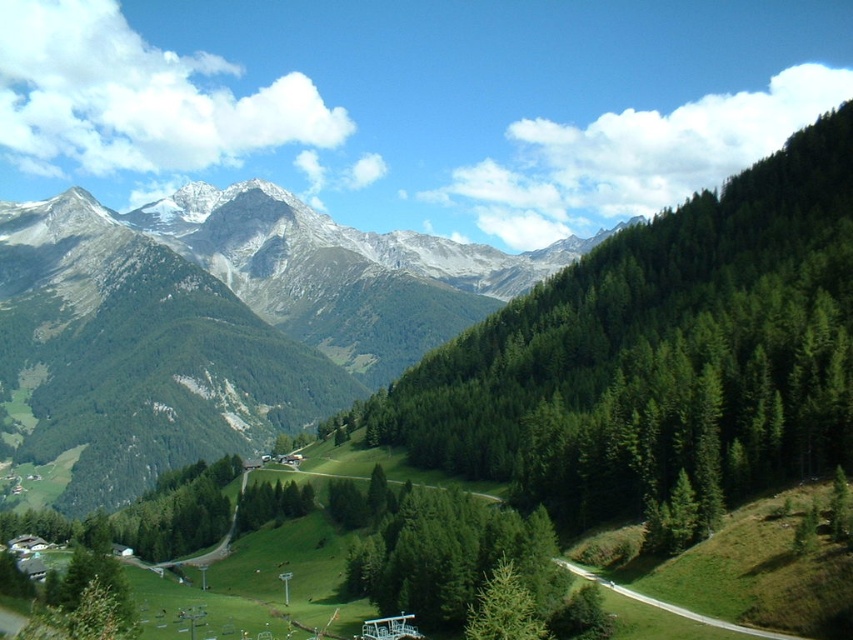
Question: Which point is closer to the camera taking this photo?

Choices:
 (A) (740, 632)
 (B) (505, 589)

Answer: (A)

Question: Which point appears closest to the camera in this image?

Choices:
 (A) (689, 612)
 (B) (515, 582)

Answer: (A)

Question: Among these objects, which one is nearest to the camera?

Choices:
 (A) green grassy path at lower center
 (B) green matte tree at center

Answer: (A)

Question: Observing the image, what is the correct spatial positioning of green matte tree at center in reference to green grassy path at lower center?

Choices:
 (A) right
 (B) left

Answer: (B)

Question: Does green matte tree at center appear under green grassy path at lower center?

Choices:
 (A) no
 (B) yes

Answer: (B)

Question: Is green matte tree at center below green grassy path at lower center?

Choices:
 (A) no
 (B) yes

Answer: (B)